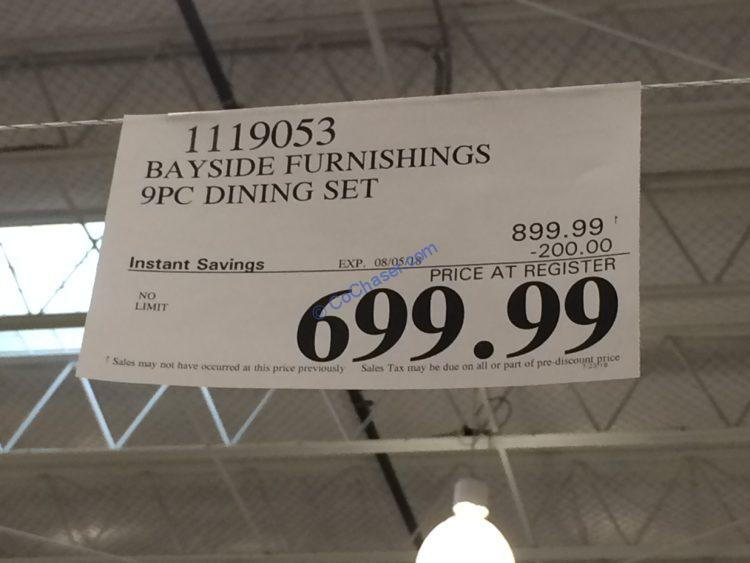
Find the location of a particular element. ceiling is located at coordinates [x=81, y=90].